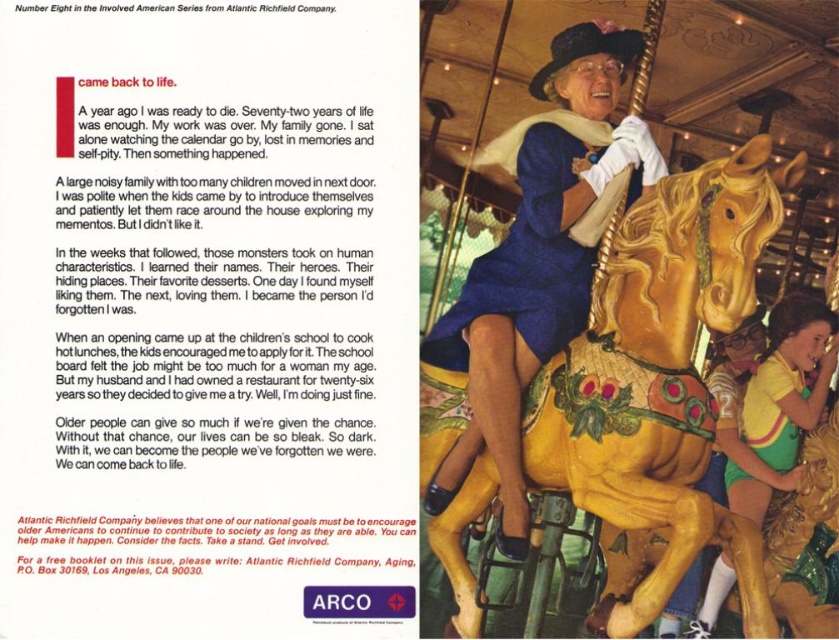
Question: Considering the real-world distances, which object is closest to the golden polished wood horse at center?

Choices:
 (A) blue satin dress at center
 (B) yellow-green jersey at right

Answer: (A)

Question: Does blue satin dress at center appear on the right side of yellow-green jersey at right?

Choices:
 (A) yes
 (B) no

Answer: (B)

Question: Which of these objects is positioned farthest from the yellow-green jersey at right?

Choices:
 (A) golden polished wood horse at center
 (B) blue satin dress at center

Answer: (B)

Question: In this image, where is golden polished wood horse at center located relative to blue satin dress at center?

Choices:
 (A) below
 (B) above

Answer: (A)

Question: Does golden polished wood horse at center have a greater width compared to blue satin dress at center?

Choices:
 (A) yes
 (B) no

Answer: (B)

Question: Among these objects, which one is nearest to the camera?

Choices:
 (A) golden polished wood horse at center
 (B) yellow-green jersey at right
 (C) blue satin dress at center

Answer: (A)